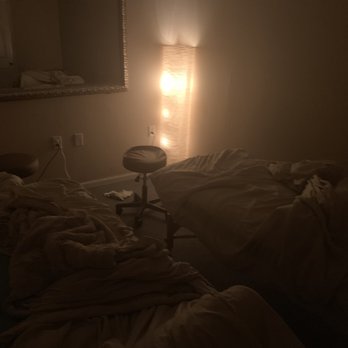
At what (x,y) coordinates should I click in order to perform the action: click on stool. Please return your answer as a coordinate pair (x, y). This screenshot has height=348, width=348. Looking at the image, I should click on (130, 170).